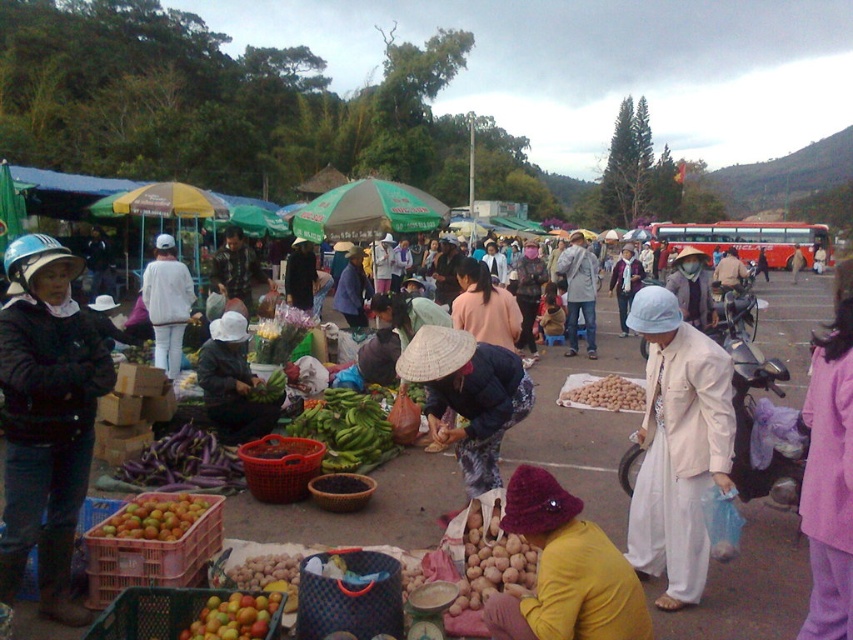
You are standing in the middle of the market and want to take a photo of both the point at coordinates (206, 468) and the point at (321, 396). Which point should you focus on first to ensure both are in focus?

You should focus on point (206, 468) first because it is closer to the camera than point (321, 396). This ensures that both points will be within the depth of field when you adjust the focus.

Based on the photo, you are a customer at the market and want to buy both the white silk hat at center and the green matte bananas at center. If you want to place them in a bag, which item should you put first to ensure both fit properly?

The white silk hat at center is bigger than the green matte bananas at center, so you should place the white silk hat at center first to ensure both items fit properly in the bag.

You are a customer at the market and want to buy both the white silk hat at center and the green matte bananas at center. Which item is taller?

The white silk hat at center is taller than the green matte bananas at center.